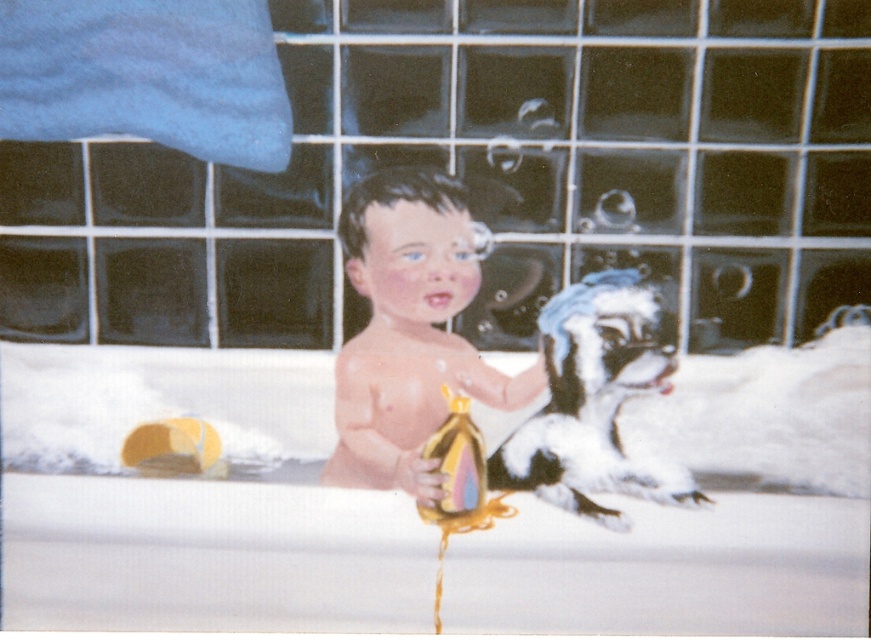
Who is more forward, (406, 298) or (511, 461)?

Point (511, 461) is more forward.

Who is positioned more to the right, smooth skin baby at center or white fur dog at center?

white fur dog at center is more to the right.

Does point (531, 365) come in front of point (660, 333)?

No, (531, 365) is behind (660, 333).

Find the location of a particular element. This screenshot has width=871, height=640. smooth skin baby at center is located at coordinates (410, 326).

Does white matte bathtub at center appear over white fur dog at center?

Incorrect, white matte bathtub at center is not positioned above white fur dog at center.

Which is behind, point (361, 582) or point (575, 401)?

The point (575, 401) is more distant.

Is point (836, 502) positioned after point (548, 317)?

No, it is not.

Where is `white matte bathtub at center`? The width and height of the screenshot is (871, 640). white matte bathtub at center is located at coordinates (193, 499).

Does white matte bathtub at center have a larger size compared to yellow rubber duck at lower left?

Yes, white matte bathtub at center is bigger than yellow rubber duck at lower left.

Does white matte bathtub at center have a greater width compared to yellow rubber duck at lower left?

Correct, the width of white matte bathtub at center exceeds that of yellow rubber duck at lower left.

Does point (323, 532) lie in front of point (198, 464)?

That is True.

You are a GUI agent. You are given a task and a screenshot of the screen. Output one action in this format:
    pyautogui.click(x=<x>, y=<y>)
    Task: Click on the white matte bathtub at center
    
    Given the screenshot: What is the action you would take?
    pyautogui.click(x=193, y=499)